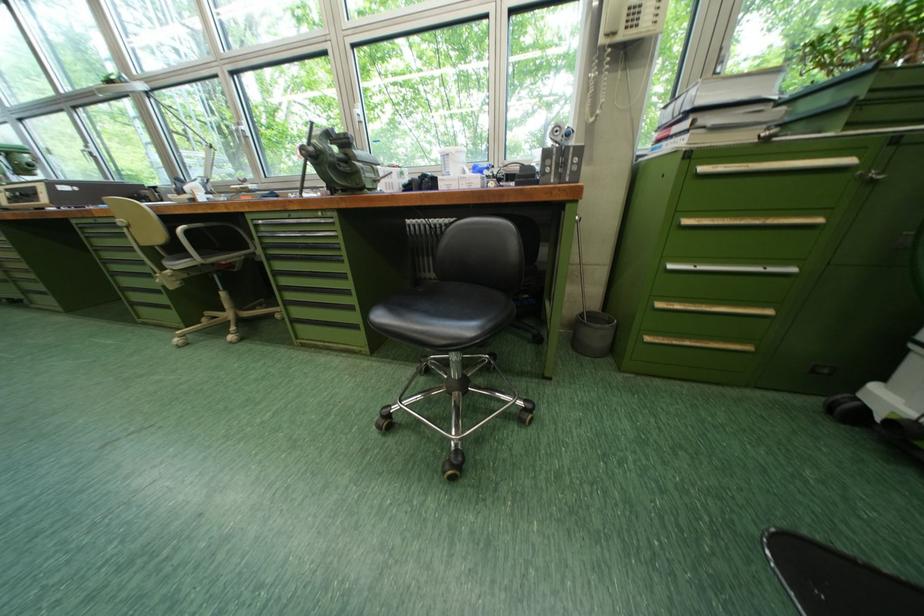
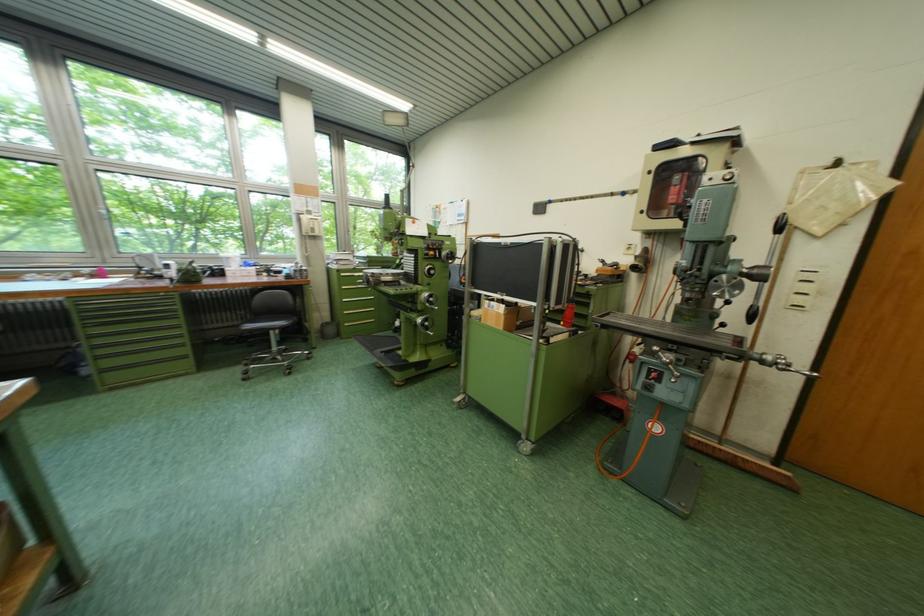
Find the pixel in the second image that matches pixel 659 341 in the first image.

(357, 326)